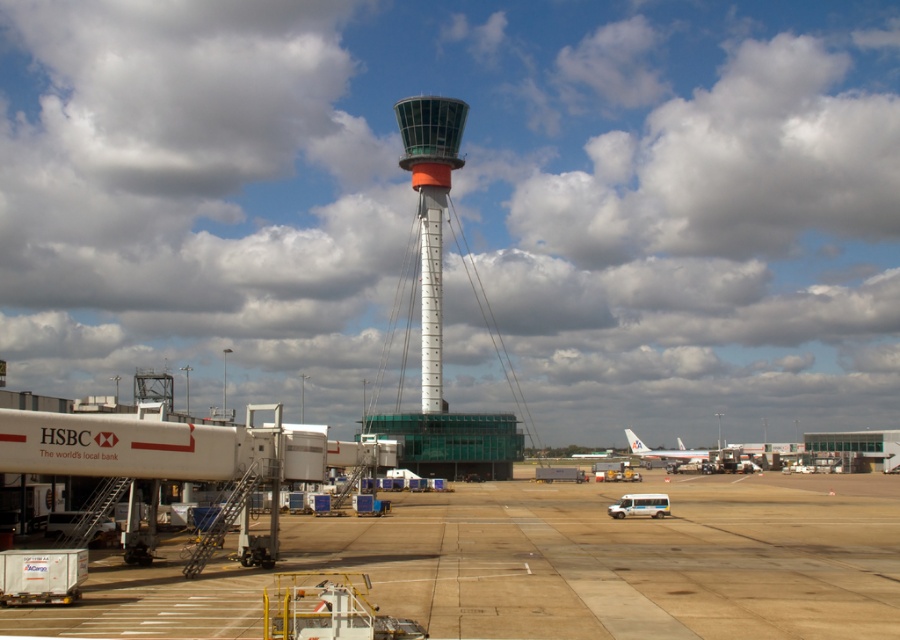
You are a pilot preparing to land at the airport depicted in the image. You notice two control towers in the scene. Which one is taller, the white metallic control tower at center or the white smooth control tower at center?

The white metallic control tower at center is taller than the white smooth control tower at center according to the description.

You are standing at the control tower and want to walk to the point marked as point (423, 326). Which direction should you go relative to the point marked as point (423, 284)?

You should walk towards the right relative to point (423, 284) because point (423, 326) is to the right of point (423, 284).

You are a pilot approaching the airport and need to locate the control tower. From your position near the white matte airplane at lower right, which direction should you look to see the white smooth control tower at center?

The white smooth control tower at center is in front of the white matte airplane at lower right, so you should look forward to see it.